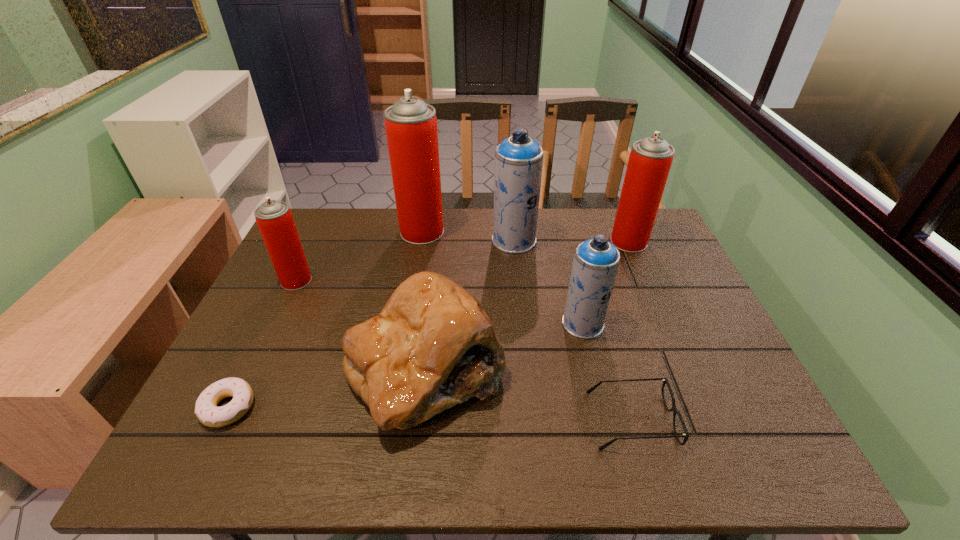
This screenshot has height=540, width=960. I want to click on object situated at the near left corner, so pyautogui.click(x=206, y=410).

This screenshot has width=960, height=540. I want to click on object at the far right corner, so click(650, 160).

You are a GUI agent. You are given a task and a screenshot of the screen. Output one action in this format:
    pyautogui.click(x=<x>, y=<y>)
    Task: Click on the vacant space at the far edge of the desktop
    
    Given the screenshot: What is the action you would take?
    pyautogui.click(x=554, y=213)

Locate an element on the screen. This screenshot has width=960, height=540. vacant space at the near edge is located at coordinates (266, 463).

The image size is (960, 540). What are the coordinates of `free space at the left edge of the desktop` in the screenshot? It's located at (268, 351).

I want to click on vacant area at the right edge, so click(x=691, y=376).

You are a GUI agent. You are given a task and a screenshot of the screen. Output one action in this format:
    pyautogui.click(x=<x>, y=<y>)
    Task: Click on the free space at the far left corner
    This screenshot has width=960, height=540.
    Given the screenshot: What is the action you would take?
    pyautogui.click(x=310, y=217)

The height and width of the screenshot is (540, 960). Find the location of `free space between the fourth aerosol can from left to right and the bread`. free space between the fourth aerosol can from left to right and the bread is located at coordinates (504, 346).

What are the coordinates of `empty location between the rightmost red aerosol can and the second nearest aerosol can` in the screenshot? It's located at (463, 261).

I want to click on free spot between the shortest object and the bread, so [327, 387].